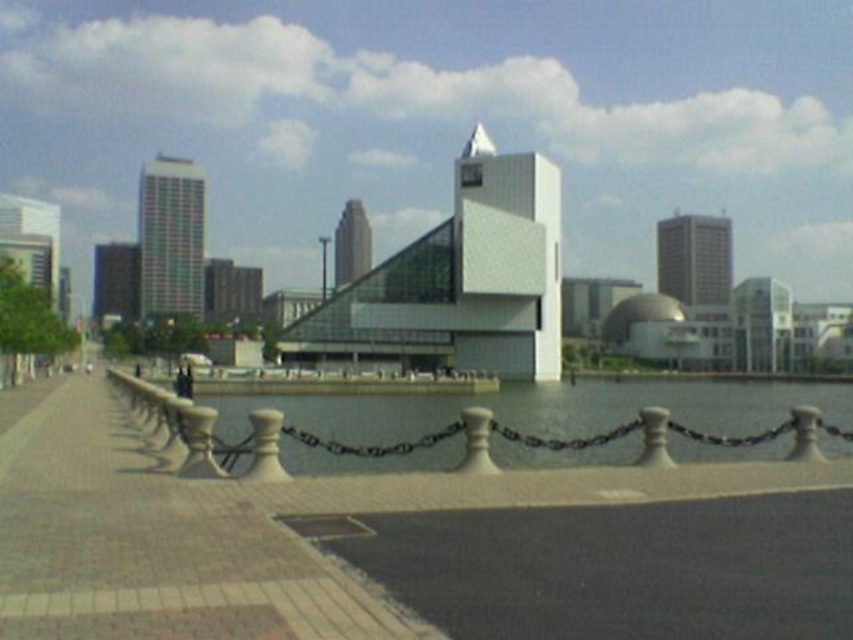
You are standing on the walkway and want to cross to the other side. The clear glass water at center is in your path. Can you walk directly across the concrete paving at center to reach the other side without stepping into the water?

The concrete paving at center is positioned on the left side of clear glass water at center, so you can walk across the concrete paving at center to the left of the water to reach the other side without stepping into the water.

You are a city planner evaluating the waterfront area. You need to determine which area is more suitable for installing a temporary art installation. Considering the spatial relationship between the concrete paving at center and the clear glass water at center, which surface would you recommend and why?

The concrete paving at center has a smaller size compared to clear glass water at center, so the clear glass water at center provides a larger space for the temporary art installation, making it more suitable for the project.

You are standing at the waterfront and looking at the scene. There are two points marked in the image, point A at coordinates point (10, 609) and point B at coordinates point (368, 464). Which point is closer to you?

Point (10, 609) is closer to the camera than point (368, 464), so point A is closer to you.